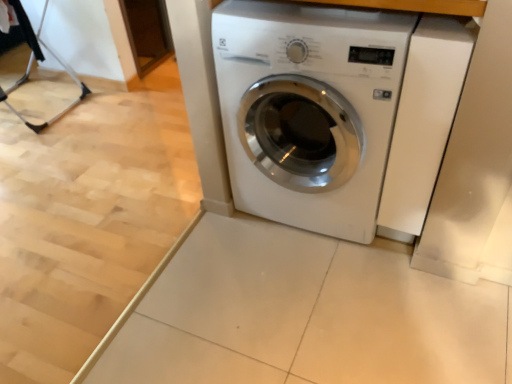
The height and width of the screenshot is (384, 512). I want to click on white glossy washing machine at center, so click(309, 110).

This screenshot has width=512, height=384. Describe the element at coordinates (309, 110) in the screenshot. I see `white glossy washing machine at center` at that location.

Find the location of a particular element. The width and height of the screenshot is (512, 384). white glossy washing machine at center is located at coordinates (309, 110).